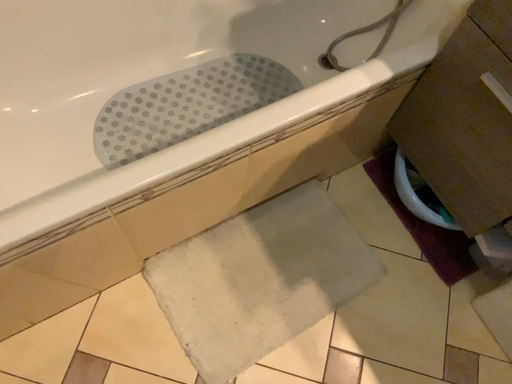
Identify the location of vacant space situated on the left part of purple fabric bath mat at lower right, positioned as the first bath mat in right-to-left order. Image resolution: width=512 pixels, height=384 pixels. [367, 210].